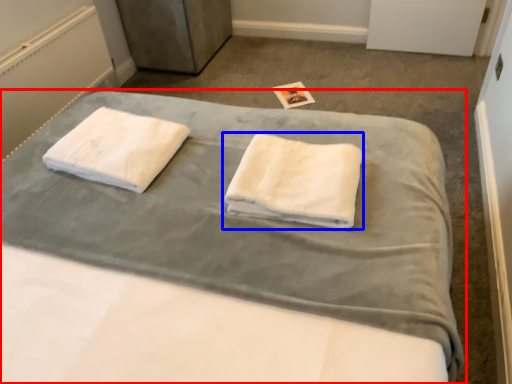
Question: Which object appears farthest to the camera in this image, bed (highlighted by a red box) or towel (highlighted by a blue box)?

Choices:
 (A) bed
 (B) towel

Answer: (B)